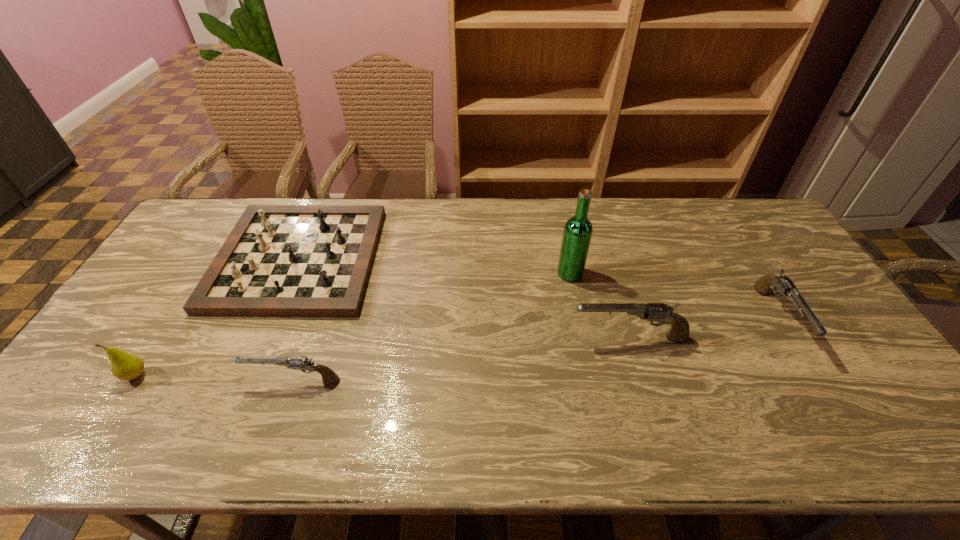
Select which object is the fifth closest to the second gun from left to right. Please provide its 2D coordinates. Your answer should be formatted as a tuple, i.e. [(x, y)], where the tuple contains the x and y coordinates of a point satisfying the conditions above.

[(126, 366)]

Locate an element on the screen. object identified as the fourth closest to the rightmost object is located at coordinates (302, 363).

Identify which gun is the third closest to the chessboard. Please provide its 2D coordinates. Your answer should be formatted as a tuple, i.e. [(x, y)], where the tuple contains the x and y coordinates of a point satisfying the conditions above.

[(783, 284)]

Locate an element on the screen. gun that stands as the closest to the beer bottle is located at coordinates (659, 312).

Locate an element on the screen. The height and width of the screenshot is (540, 960). free region that satisfies the following two spatial constraints: 1. on the back side of the leftmost object; 2. on the left side of the chessboard is located at coordinates (210, 259).

Identify the location of vacant area in the image that satisfies the following two spatial constraints: 1. on the back side of the tallest object; 2. on the left side of the leftmost object. coord(201,273).